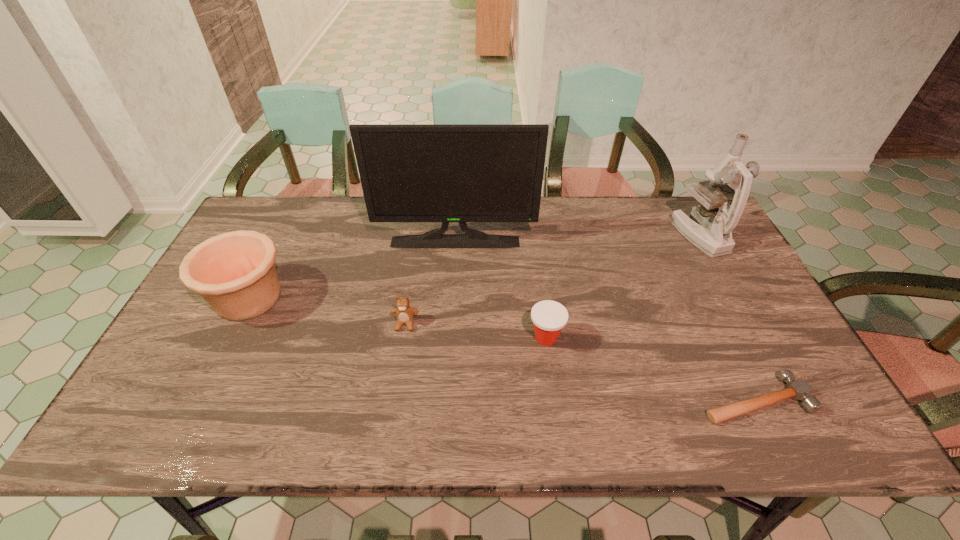
Find the location of `vacant point located 0.120m on the right of the third tallest object`. vacant point located 0.120m on the right of the third tallest object is located at coordinates (333, 298).

The height and width of the screenshot is (540, 960). I want to click on free space located 0.090m on the front of the Dixie cup, so click(552, 383).

Identify the location of blank space located on the front-facing side of the teddy bear. (396, 390).

This screenshot has width=960, height=540. I want to click on blank space located 0.150m on the back of the hammer, so click(719, 326).

This screenshot has width=960, height=540. Identify the location of monitor that is at the far edge. (445, 173).

The height and width of the screenshot is (540, 960). I want to click on microscope at the far edge, so click(x=712, y=233).

Find the location of a particular element. object that is at the near edge is located at coordinates (797, 389).

Locate an element on the screen. object situated at the left edge is located at coordinates (235, 273).

Identify the location of microscope present at the right edge. (712, 233).

The image size is (960, 540). In order to click on hammer at the right edge in this screenshot , I will do `click(797, 389)`.